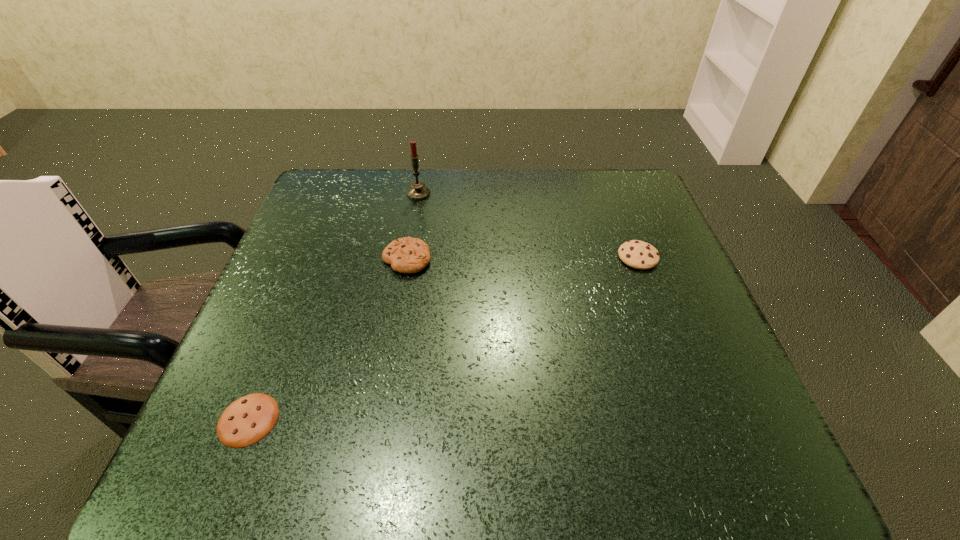
Where is `object that is at the far edge`? Image resolution: width=960 pixels, height=540 pixels. object that is at the far edge is located at coordinates (418, 191).

The width and height of the screenshot is (960, 540). Find the location of `object at the near edge`. object at the near edge is located at coordinates (247, 420).

At what (x,y) coordinates should I click in order to perform the action: click on object at the left edge. Please return your answer as a coordinate pair (x, y). Looking at the image, I should click on (247, 420).

You are a GUI agent. You are given a task and a screenshot of the screen. Output one action in this format:
    pyautogui.click(x=<x>, y=<y>)
    Task: Click on the object located in the right edge section of the desktop
    
    Given the screenshot: What is the action you would take?
    pyautogui.click(x=637, y=254)

The image size is (960, 540). I want to click on object that is at the near left corner, so click(x=247, y=420).

Image resolution: width=960 pixels, height=540 pixels. I want to click on vacant space at the far edge of the desktop, so click(x=427, y=171).

Find the location of a particular element. The height and width of the screenshot is (540, 960). free space at the near edge is located at coordinates (579, 477).

Where is `vacant space at the left edge of the desktop`? vacant space at the left edge of the desktop is located at coordinates (299, 319).

The image size is (960, 540). What are the coordinates of `vacant space at the right edge of the desktop` in the screenshot? It's located at (668, 271).

Locate an element on the screen. Image resolution: width=960 pixels, height=540 pixels. free region at the far left corner is located at coordinates (363, 188).